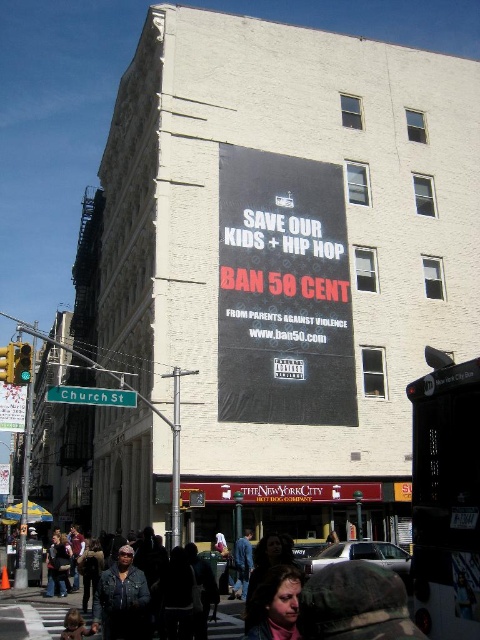
Question: Is the position of black matte poster at center less distant than that of blue jeans at center?

Choices:
 (A) yes
 (B) no

Answer: (B)

Question: Does black matte poster at center have a larger size compared to blue jeans at center?

Choices:
 (A) yes
 (B) no

Answer: (A)

Question: Which of the following is the farthest from the observer?

Choices:
 (A) denim jacket at lower center
 (B) blue jeans at center

Answer: (B)

Question: Which of these objects is positioned closest to the black matte poster at center?

Choices:
 (A) green metallic street sign at lower left
 (B) denim jacket at lower center
 (C) matte pink scarf at lower center

Answer: (A)

Question: Which object is closer to the camera taking this photo?

Choices:
 (A) green metallic street sign at lower left
 (B) blue jeans at center
 (C) denim jacket at lower center

Answer: (C)

Question: Observing the image, what is the correct spatial positioning of black matte poster at center in reference to denim jacket at lower center?

Choices:
 (A) right
 (B) left

Answer: (A)